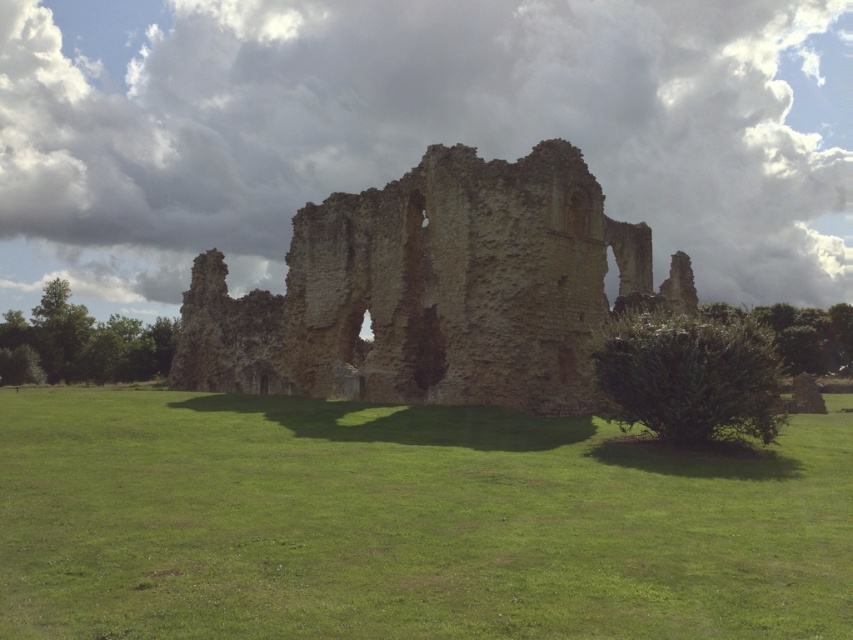
Looking at this image, you are standing at the entrance of the medieval ruins and see two points marked on the ground. The first point is labeled as point (163,518) and the second as point (471,380). Which point is closer to you?

Point (163,518) is in front of point (471,380), so it is closer to you.

You are standing in the field near the ruins and want to walk to the green grass at center. Which direction should you move relative to the weathered stone castle at center?

You should move to the right of the weathered stone castle at center to reach the green grass at center, as it is located to the right of the castle.

You are standing at the origin point in the image. Which direction should you move to reach the green grass at center?

The green grass at center is located at the 2D coordinates point (405, 524), so you should move towards the right and slightly upwards to reach it.